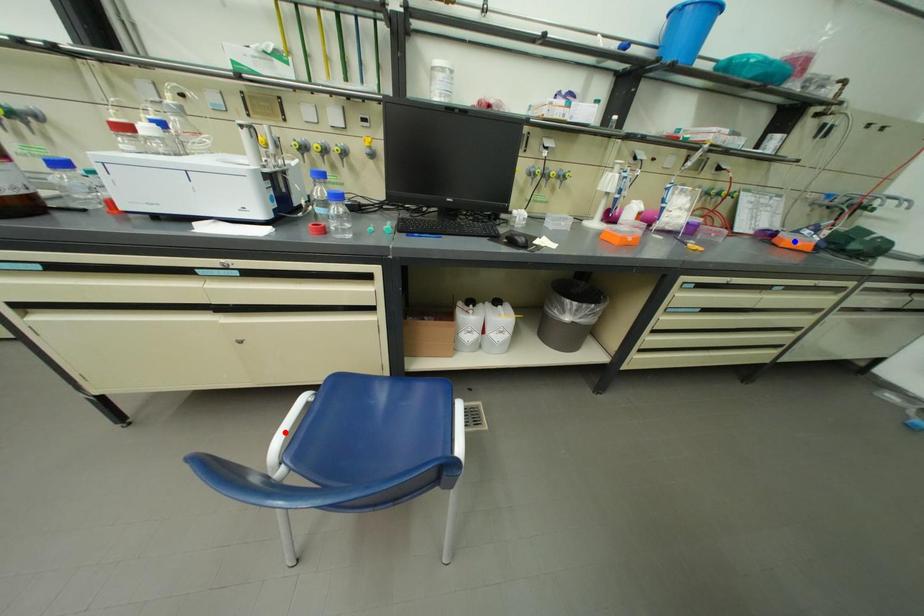
Question: In the image, two points are highlighted. Which point is nearer to the camera? Reply with the corresponding letter.

Choices:
 (A) blue point
 (B) red point

Answer: (B)